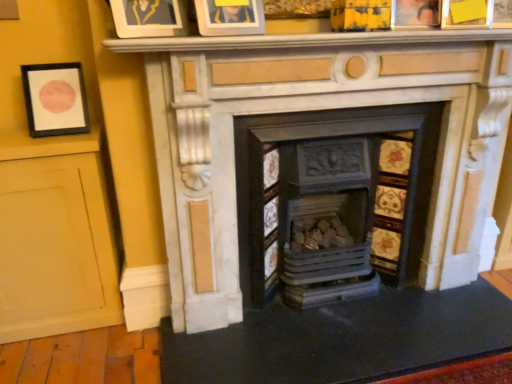
Question: Considering the positions of matte gold picture frame at upper center, the 3th picture frame in the right-to-left sequence, and rustic wood logs at center, which is the 2th fireplace from right to left, in the image, is matte gold picture frame at upper center, the 3th picture frame in the right-to-left sequence, wider or thinner than rustic wood logs at center, which is the 2th fireplace from right to left,?

Choices:
 (A) thin
 (B) wide

Answer: (A)

Question: From the image's perspective, is matte gold picture frame at upper center, which ranks as the second picture frame in left-to-right order, located above or below rustic wood logs at center, positioned as the first fireplace in left-to-right order?

Choices:
 (A) above
 (B) below

Answer: (A)

Question: Estimate the real-world distances between objects in this image. Which object is farther from the white marble fireplace at center, which is the second fireplace in left-to-right order?

Choices:
 (A) matte black picture frame at left, which ranks as the 4th picture frame in right-to-left order
 (B) wooden photo frame at upper right, the 3th picture frame positioned from the left
 (C) matte gold picture frame at upper center, the 3th picture frame in the right-to-left sequence
 (D) yellow paper picture frame at upper right, which is the 4th picture frame from left to right
 (E) rustic wood logs at center, which is the 2th fireplace from right to left

Answer: (A)

Question: Estimate the real-world distances between objects in this image. Which object is closer to the wooden photo frame at upper right, the 3th picture frame positioned from the left?

Choices:
 (A) yellow paper picture frame at upper right, which is the 4th picture frame from left to right
 (B) matte black picture frame at left, which ranks as the 4th picture frame in right-to-left order
 (C) matte gold picture frame at upper center, which ranks as the second picture frame in left-to-right order
 (D) rustic wood logs at center, positioned as the first fireplace in left-to-right order
 (E) white marble fireplace at center, arranged as the first fireplace when viewed from the right

Answer: (A)